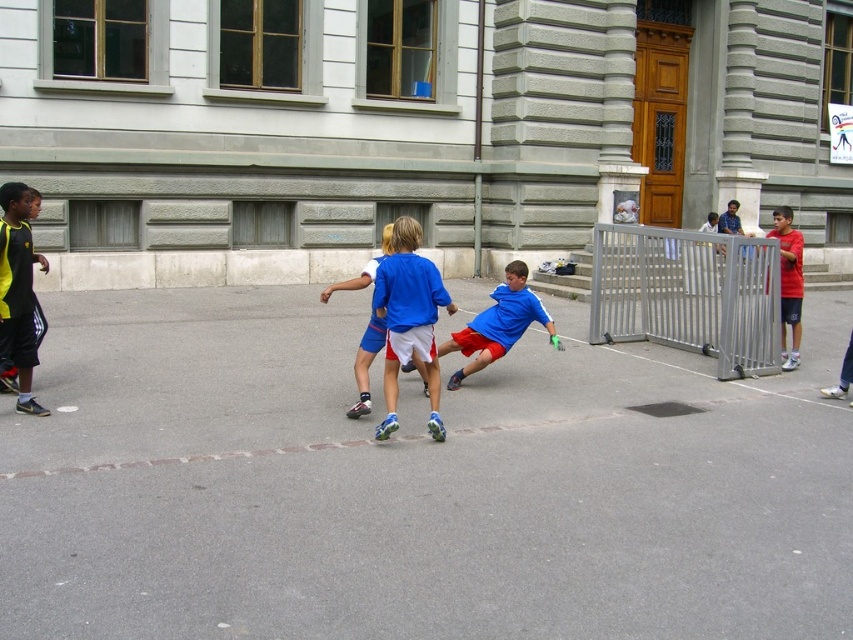
Question: Which object is the farthest from the blue matte shorts at center?

Choices:
 (A) blue fabric shorts at center
 (B) red shirt at right

Answer: (B)

Question: Does blue matte shorts at center have a smaller size compared to red shirt at right?

Choices:
 (A) yes
 (B) no

Answer: (B)

Question: Which of the following is the farthest from the observer?

Choices:
 (A) (479, 349)
 (B) (318, 300)
 (C) (403, 289)
 (D) (769, 236)

Answer: (B)

Question: Among these objects, which one is nearest to the camera?

Choices:
 (A) blue matte shorts at center
 (B) blue fabric shorts at center
 (C) red shirt at right
 (D) blue jersey shorts at center

Answer: (A)

Question: Can you confirm if red shirt at right is positioned below blue fabric shorts at center?

Choices:
 (A) no
 (B) yes

Answer: (A)

Question: Is blue matte shorts at center bigger than blue fabric shorts at center?

Choices:
 (A) yes
 (B) no

Answer: (A)